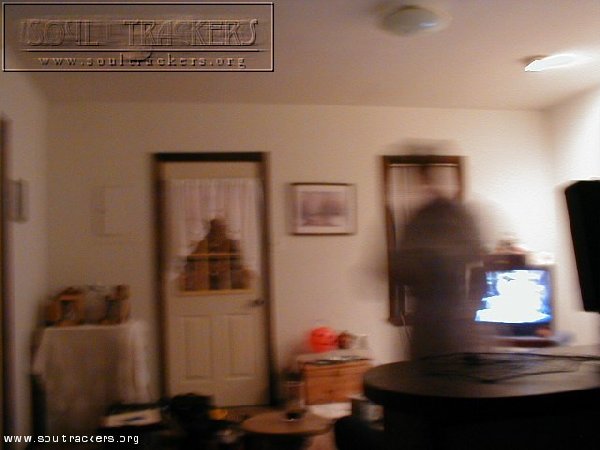
The width and height of the screenshot is (600, 450). I want to click on door, so click(x=210, y=329).